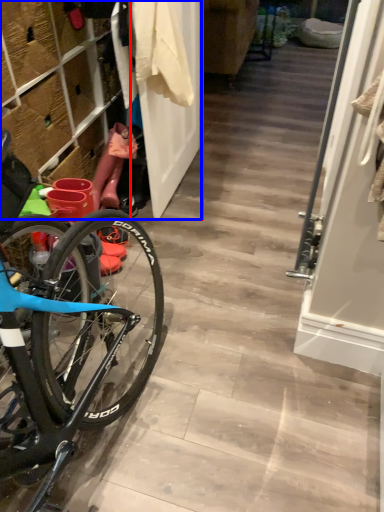
Question: Which of the following is the closest to the observer, door (highlighted by a red box) or closet (highlighted by a blue box)?

Choices:
 (A) door
 (B) closet

Answer: (B)